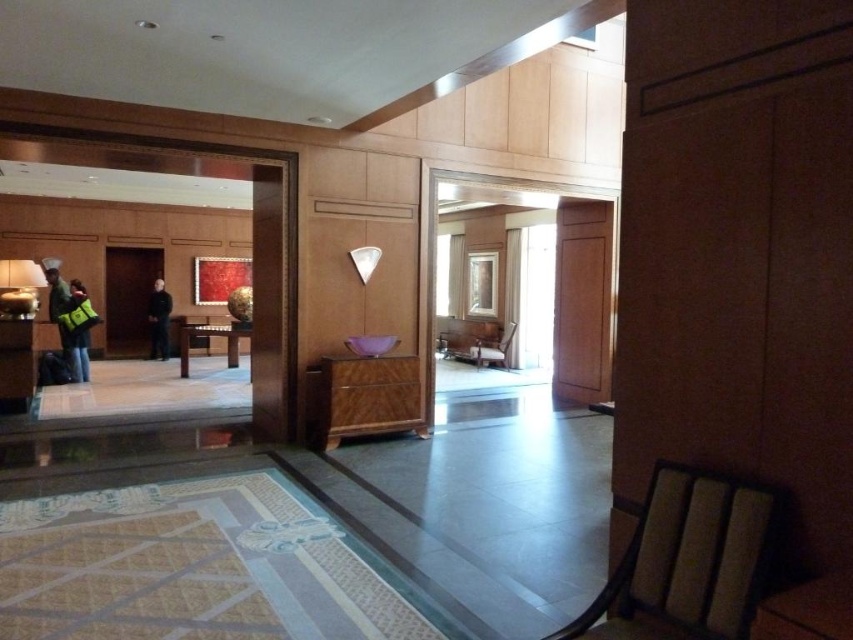
Which is behind, point (68, 308) or point (161, 321)?

Point (161, 321)

Is the position of reflective green jacket at left more distant than that of black matte jacket at center?

No, reflective green jacket at left is closer to the viewer.

Between point (73, 305) and point (149, 307), which one is positioned in front?

Point (73, 305)

The width and height of the screenshot is (853, 640). What are the coordinates of `reflective green jacket at left` in the screenshot? It's located at (79, 349).